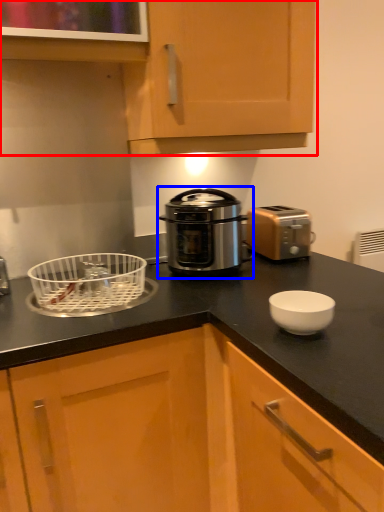
Question: Which object appears farthest to the camera in this image, cabinetry (highlighted by a red box) or home appliance (highlighted by a blue box)?

Choices:
 (A) cabinetry
 (B) home appliance

Answer: (B)